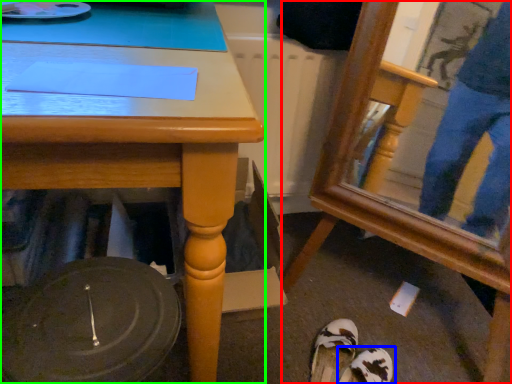
Question: Considering the real-world distances, which object is farthest from swivel chair (highlighted by a red box)? footwear (highlighted by a blue box) or desk (highlighted by a green box)?

Choices:
 (A) footwear
 (B) desk

Answer: (B)